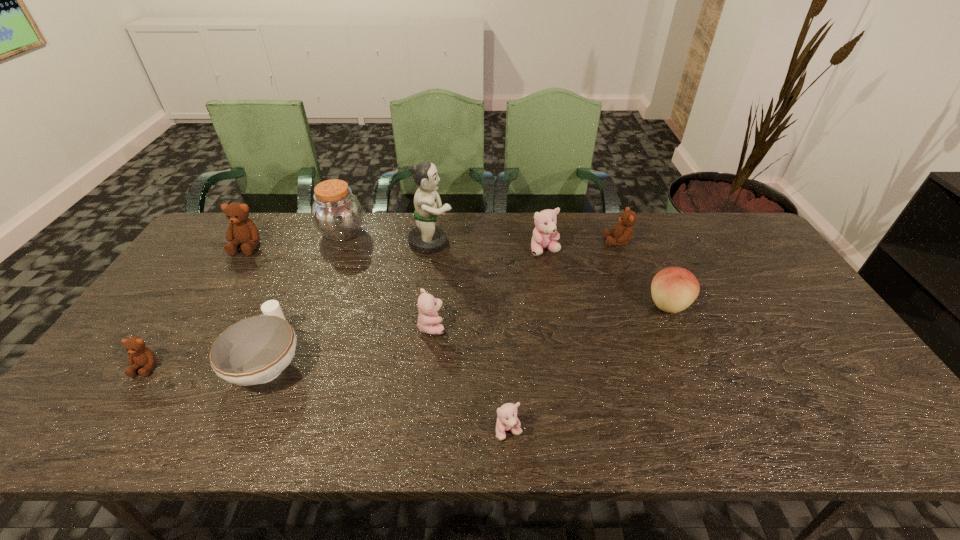
Locate which teddy bear is the second closest to the farthest pink teddy bear. Please provide its 2D coordinates. Your answer should be formatted as a tuple, i.e. [(x, y)], where the tuple contains the x and y coordinates of a point satisfying the conditions above.

[(428, 320)]

Locate which teddy bear is the closest to the peach. Please provide its 2D coordinates. Your answer should be formatted as a tuple, i.e. [(x, y)], where the tuple contains the x and y coordinates of a point satisfying the conditions above.

[(623, 232)]

Identify the location of the closest pink teddy bear to the green figurine. This screenshot has height=540, width=960. (545, 236).

Locate an element on the screen. pink teddy bear that is the second closest to the rightmost teddy bear is located at coordinates (428, 320).

The image size is (960, 540). In order to click on the closest brown teddy bear to the second smallest pink teddy bear in this screenshot , I will do `click(623, 232)`.

At what (x,y) coordinates should I click in order to perform the action: click on brown teddy bear that is the second closest to the second biggest brown teddy bear. Please return your answer as a coordinate pair (x, y). Looking at the image, I should click on (140, 356).

Where is `free space that satisfies the following two spatial constraints: 1. on the face of the rightmost teddy bear; 2. on the face of the nearest brown teddy bear`? This screenshot has height=540, width=960. free space that satisfies the following two spatial constraints: 1. on the face of the rightmost teddy bear; 2. on the face of the nearest brown teddy bear is located at coordinates (665, 367).

Find the location of a particular element. The width and height of the screenshot is (960, 540). blank space that satisfies the following two spatial constraints: 1. on the face of the second biggest brown teddy bear; 2. on the face of the biggest brown teddy bear is located at coordinates (619, 246).

Locate an element on the screen. The height and width of the screenshot is (540, 960). blank space that satisfies the following two spatial constraints: 1. on the face of the rightmost brown teddy bear; 2. on the face of the second nearest teddy bear is located at coordinates (665, 367).

Where is `vacant area in the image that satisfies the following two spatial constraints: 1. at the face of the biggest pink teddy bear; 2. at the face of the third teddy bear from left to right`? vacant area in the image that satisfies the following two spatial constraints: 1. at the face of the biggest pink teddy bear; 2. at the face of the third teddy bear from left to right is located at coordinates (559, 326).